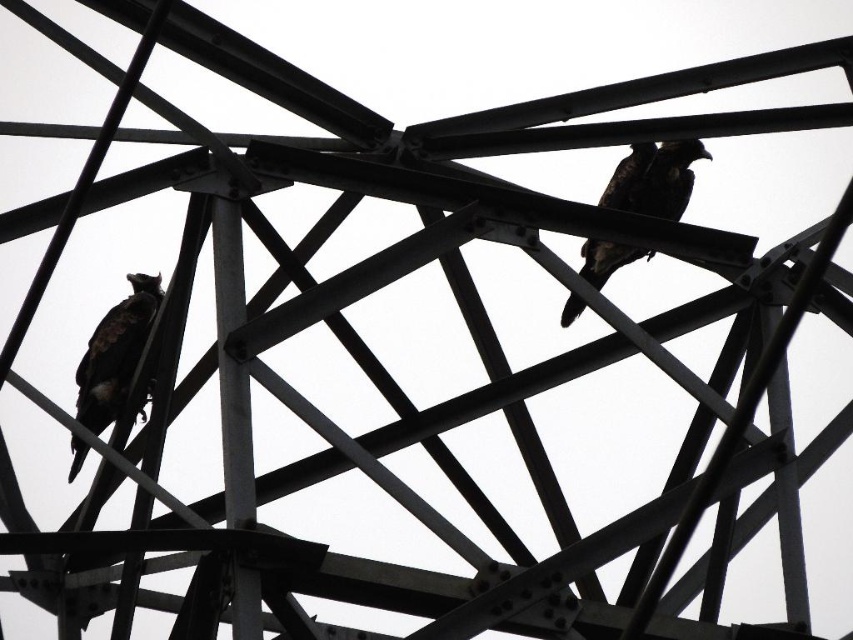
Based on the photo, you are a birdwatcher observing the two birds on the metal structure. Which bird has a smaller width between the dark brown feathers at left and the brown feathered bird at upper center?

The dark brown feathers at left has a smaller width than the brown feathered bird at upper center.

You are a birdwatcher observing the two birds on the metal structure. Which of the two birds, the dark brown feathers at left or the brown feathered bird at upper center, is larger in size?

The dark brown feathers at left has a smaller size compared to brown feathered bird at upper center, so the brown feathered bird at upper center is larger in size.

You are a birdwatcher observing the two birds on the metal structure. Which bird, the dark brown feathers at left or the brown feathered bird at upper center, is closer to you?

The dark brown feathers at left is closer to you because it is further to the viewer than the brown feathered bird at upper center.